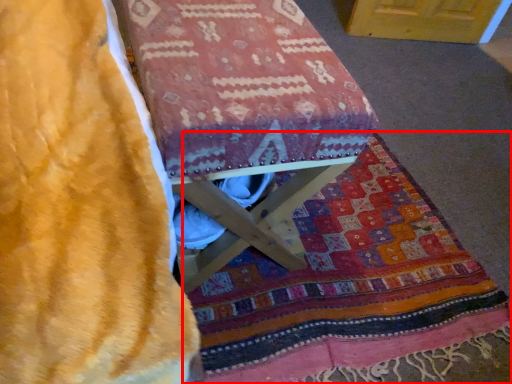
Question: Considering the relative positions of blanket (annotated by the red box) and furniture in the image provided, where is blanket (annotated by the red box) located with respect to the staircase?

Choices:
 (A) right
 (B) left

Answer: (A)